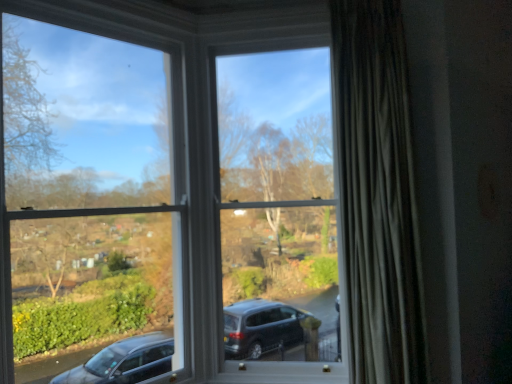
Question: From the image's perspective, is white plastic window frame at upper left, which is the 2th window frame in right-to-left order, over white plastic window frame at center, the first window frame viewed from the right?

Choices:
 (A) yes
 (B) no

Answer: (B)

Question: Can we say white plastic window frame at upper left, which is the 2th window frame in right-to-left order, lies outside white plastic window frame at center, the first window frame viewed from the right?

Choices:
 (A) no
 (B) yes

Answer: (B)

Question: Is white plastic window frame at upper left, which is the 2th window frame in right-to-left order, not near white plastic window frame at center, which appears as the 2th window frame when viewed from the left?

Choices:
 (A) yes
 (B) no

Answer: (B)

Question: From the image's perspective, does white plastic window frame at upper left, which is the 2th window frame in right-to-left order, appear lower than white plastic window frame at center, the first window frame viewed from the right?

Choices:
 (A) yes
 (B) no

Answer: (A)

Question: Does white plastic window frame at upper left, which is the 2th window frame in right-to-left order, lie in front of white plastic window frame at center, the first window frame viewed from the right?

Choices:
 (A) no
 (B) yes

Answer: (B)

Question: Can you confirm if white plastic window frame at upper left, which is counted as the first window frame, starting from the left, is positioned to the left of white plastic window frame at center, the first window frame viewed from the right?

Choices:
 (A) no
 (B) yes

Answer: (B)

Question: Is the depth of white plastic window frame at center, which appears as the 2th window frame when viewed from the left, less than that of silky gray curtain at right?

Choices:
 (A) no
 (B) yes

Answer: (A)

Question: Is white plastic window frame at center, the first window frame viewed from the right, positioned beyond the bounds of silky gray curtain at right?

Choices:
 (A) yes
 (B) no

Answer: (A)

Question: From a real-world perspective, is white plastic window frame at center, which appears as the 2th window frame when viewed from the left, physically above silky gray curtain at right?

Choices:
 (A) yes
 (B) no

Answer: (B)

Question: Can you confirm if white plastic window frame at center, which appears as the 2th window frame when viewed from the left, is thinner than silky gray curtain at right?

Choices:
 (A) no
 (B) yes

Answer: (B)

Question: Considering the relative sizes of white plastic window frame at center, the first window frame viewed from the right, and silky gray curtain at right in the image provided, is white plastic window frame at center, the first window frame viewed from the right, wider than silky gray curtain at right?

Choices:
 (A) yes
 (B) no

Answer: (B)

Question: Can you confirm if white plastic window frame at center, which appears as the 2th window frame when viewed from the left, is positioned to the left of silky gray curtain at right?

Choices:
 (A) yes
 (B) no

Answer: (A)

Question: Would you consider silky gray curtain at right to be distant from white plastic window frame at upper left, which is counted as the first window frame, starting from the left?

Choices:
 (A) yes
 (B) no

Answer: (A)